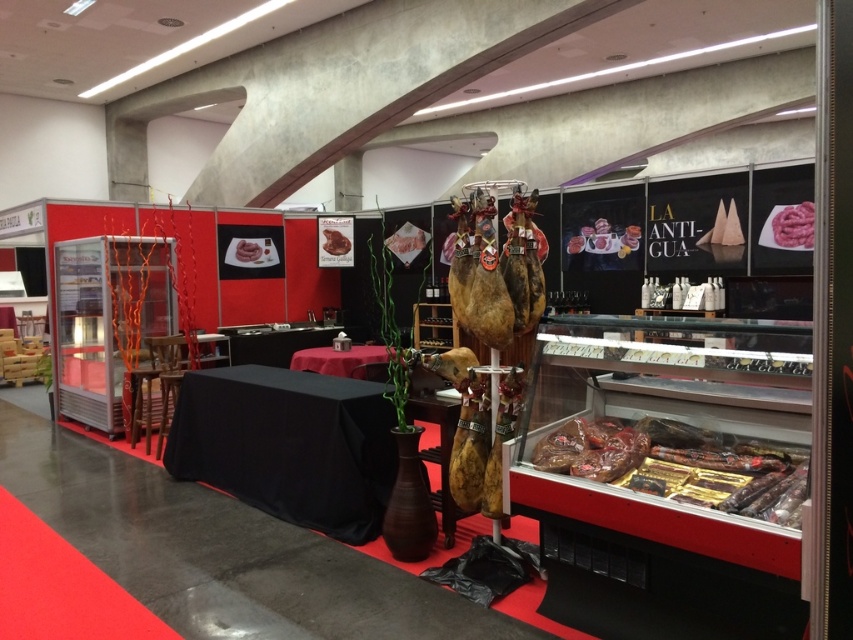
You are a food critic standing at the entrance of the exhibition. You see the black fabric table at center and the pink raw meat at upper right. Which object is positioned higher in the image?

The pink raw meat at upper right is positioned higher than the black fabric table at center, as the black fabric table at center is located below it.